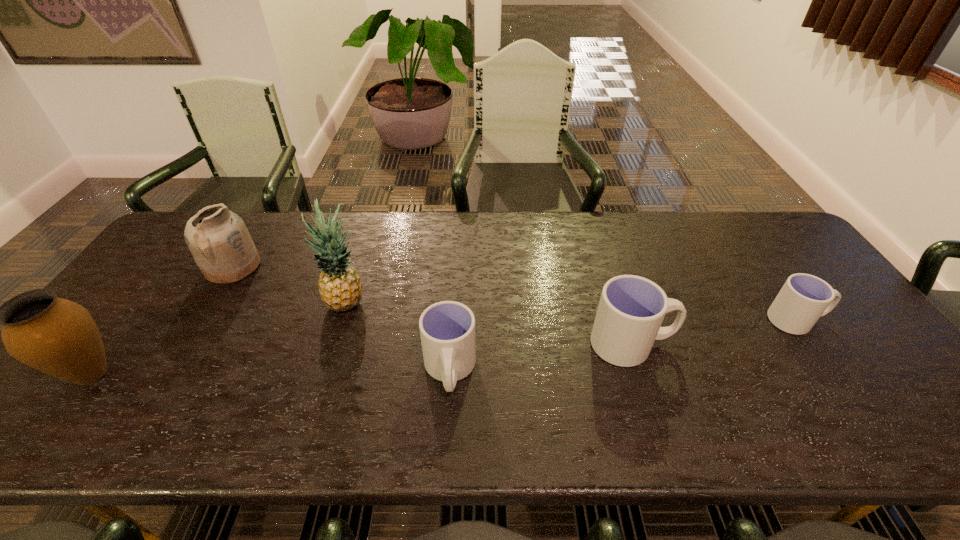
Where is `object at the near left corner`? object at the near left corner is located at coordinates (59, 337).

In the image, there is a desktop. At what (x,y) coordinates should I click in order to perform the action: click on free space at the far edge. Please return your answer as a coordinate pair (x, y). Looking at the image, I should click on (259, 245).

Identify the location of vacant area at the near edge of the desktop. The image size is (960, 540). (780, 396).

I want to click on vacant space at the right edge of the desktop, so click(847, 357).

Where is `vacant space at the near left corner`? The width and height of the screenshot is (960, 540). vacant space at the near left corner is located at coordinates (107, 376).

At what (x,y) coordinates should I click in order to perform the action: click on empty location between the second object from right to left and the urn. Please return your answer as a coordinate pair (x, y). Image resolution: width=960 pixels, height=540 pixels. Looking at the image, I should click on (362, 359).

Locate an element on the screen. The width and height of the screenshot is (960, 540). vacant area that lies between the urn and the fifth object from right to left is located at coordinates (162, 320).

Find the location of `vacant area that lies between the pineapple and the second object from left to right`. vacant area that lies between the pineapple and the second object from left to right is located at coordinates tap(290, 286).

Where is `free space between the second cup from right to left and the leftmost object`? This screenshot has width=960, height=540. free space between the second cup from right to left and the leftmost object is located at coordinates (362, 359).

Where is `unoccupied position between the pottery and the second tallest cup`? The width and height of the screenshot is (960, 540). unoccupied position between the pottery and the second tallest cup is located at coordinates (341, 319).